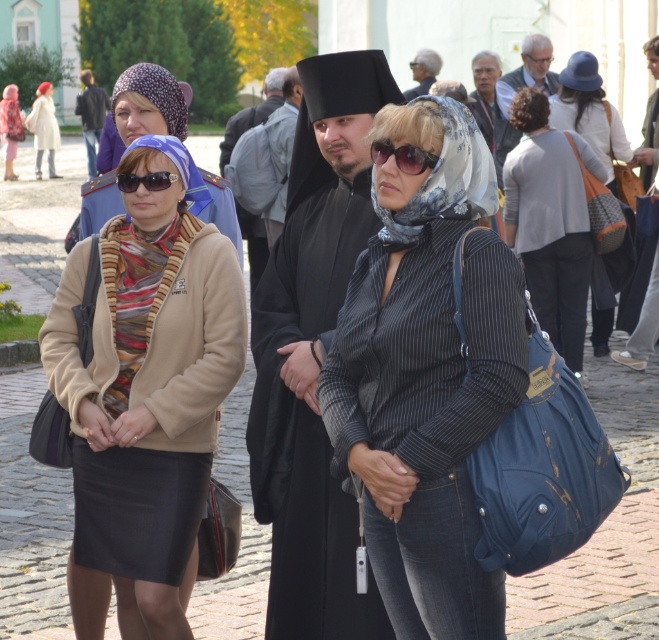
Question: Which is nearer to the matte beige coat at center?

Choices:
 (A) sunglasses at center
 (B) striped scarf at center
 (C) gray fabric backpack at center
 (D) leather jacket at right

Answer: (C)

Question: Is striped fabric shirt at center below light beige fabric scarf at upper left?

Choices:
 (A) no
 (B) yes

Answer: (B)

Question: Considering the real-world distances, which object is closest to the gray hair at upper right?

Choices:
 (A) gray fabric backpack at center
 (B) leather jacket at right
 (C) striped fabric scarf at center

Answer: (A)

Question: Is striped fabric scarf at center bigger than leather jacket at right?

Choices:
 (A) no
 (B) yes

Answer: (B)

Question: Which of these objects is positioned closest to the knitted orange bag at center?

Choices:
 (A) striped scarf at center
 (B) beige fleece jacket at center

Answer: (A)

Question: Considering the relative positions of striped fabric scarf at center and transparent plastic goggles at center in the image provided, where is striped fabric scarf at center located with respect to transparent plastic goggles at center?

Choices:
 (A) left
 (B) right

Answer: (A)